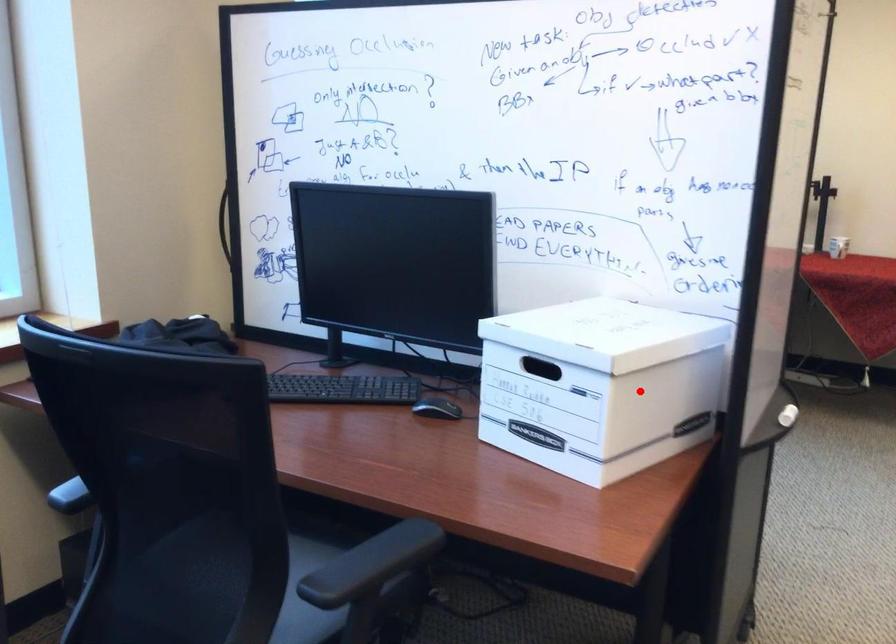
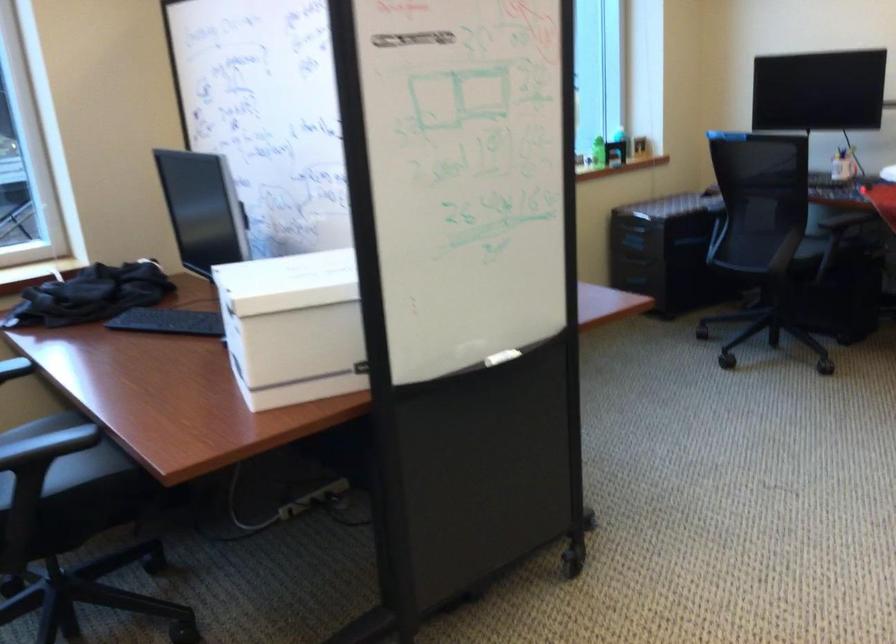
In the second image, find the point that corresponds to the highlighted location in the first image.

(293, 327)